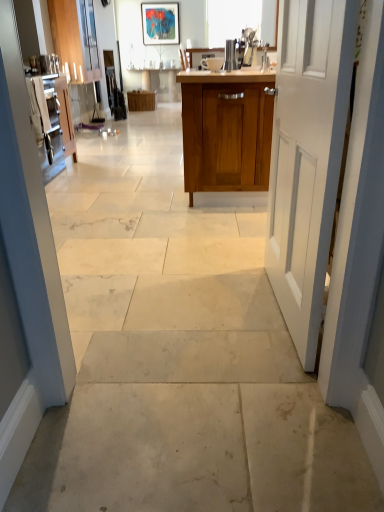
Question: Is matte acrylic painting at upper center inside or outside of matte wood cabinet at upper left, placed as the first cabinetry when sorted from back to front?

Choices:
 (A) inside
 (B) outside

Answer: (B)

Question: Is point coord(165,20) positioned closer to the camera than point coord(64,5)?

Choices:
 (A) farther
 (B) closer

Answer: (A)

Question: Which of these objects is positioned closest to the matte acrylic painting at upper center?

Choices:
 (A) satin silver kettle at center
 (B) white matte door at right
 (C) matte wood cabinet at upper left, positioned as the 1th cabinetry in left-to-right order
 (D) wooden cabinet at center, arranged as the first cabinetry when viewed from the front

Answer: (C)

Question: Considering the real-world distances, which object is farthest from the matte wood cabinet at upper left, the second cabinetry when ordered from front to back?

Choices:
 (A) wooden cabinet at center, which is the 2th cabinetry in back-to-front order
 (B) matte acrylic painting at upper center
 (C) satin silver kettle at center
 (D) white matte door at right

Answer: (D)